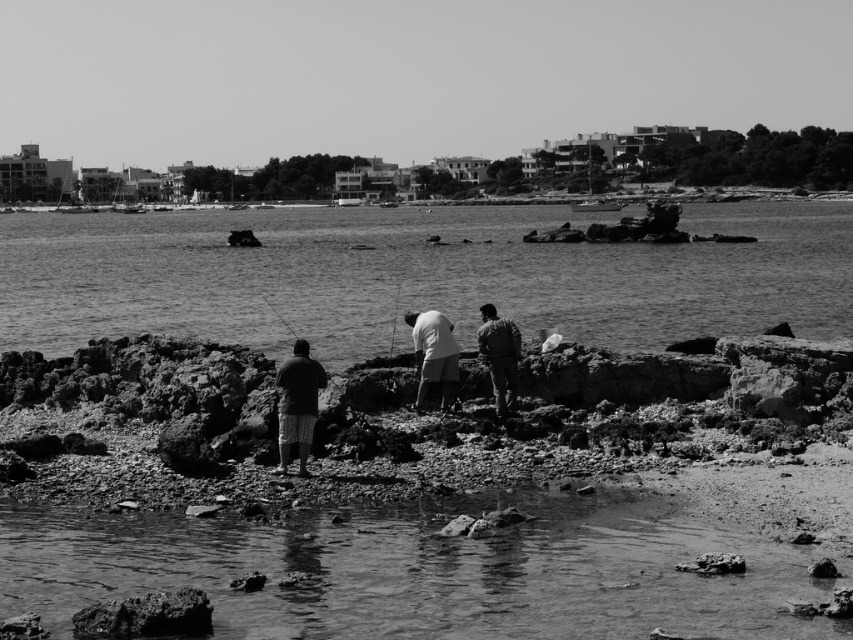
You are a photographer trying to capture the scene of the dark green fabric jacket at center and the smooth plastic fishing pole at center. From the photographer perspective, which object is positioned to the right side?

The dark green fabric jacket at center is positioned to the right of the smooth plastic fishing pole at center.

You are a photographer trying to capture a clear shot of the smooth plastic fishing pole at center without the dark green fabric jacket at center blocking it. Based on the scene, can you adjust your position so that the jacket is out of the frame?

The dark green fabric jacket at center is in front of the smooth plastic fishing pole at center, so moving your camera position slightly behind or to the side of the jacket would allow you to frame the fishing pole without obstruction.

You are a photographer trying to capture a candid shot of the striped shorts at center and the dark green fabric jacket at center. Since you want to ensure both subjects are in focus, you need to know which one is bigger. Which one is larger?

The striped shorts at center has a larger size compared to dark green fabric jacket at center, so you should focus on the striped shorts at center first as it is bigger.